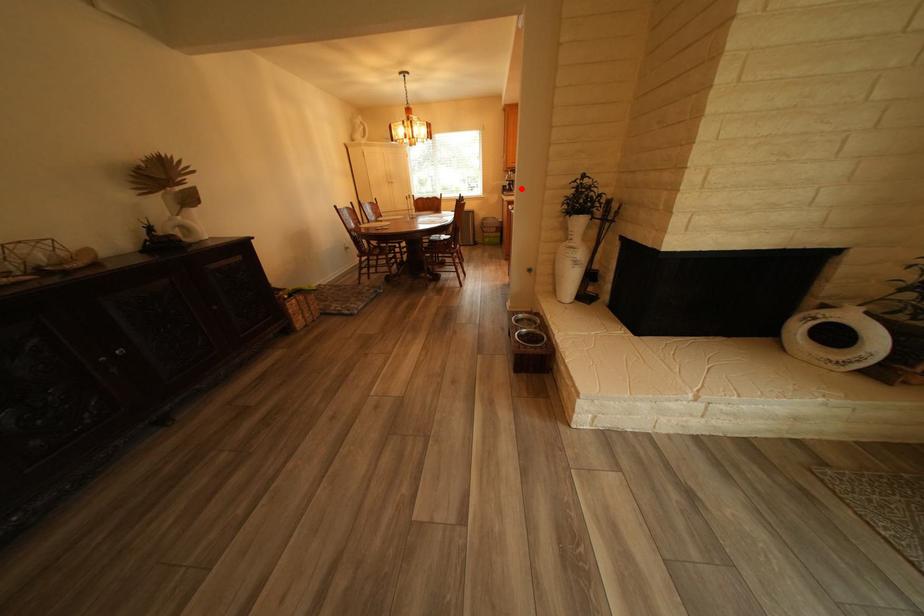
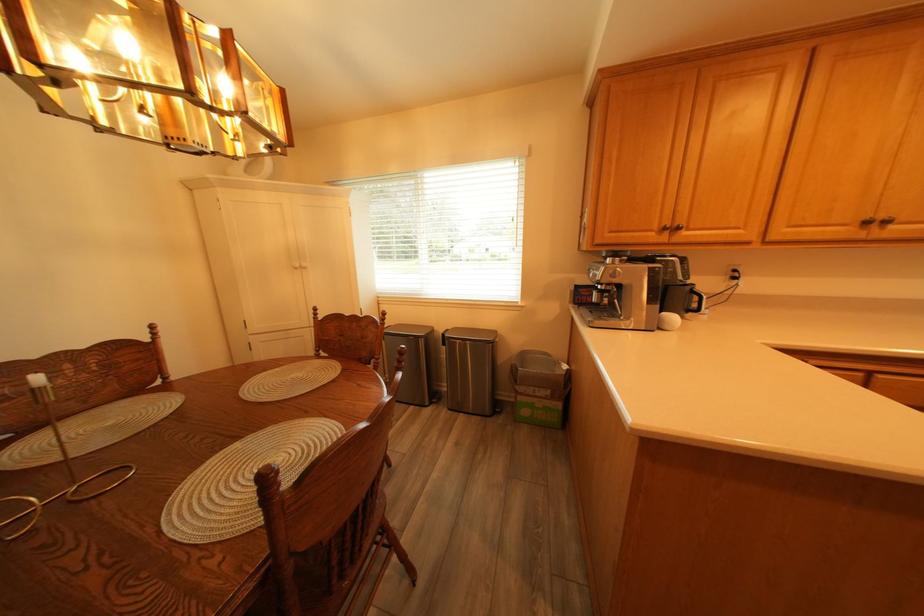
Find the pixel in the second image that matches the highlighted location in the first image.

(609, 301)